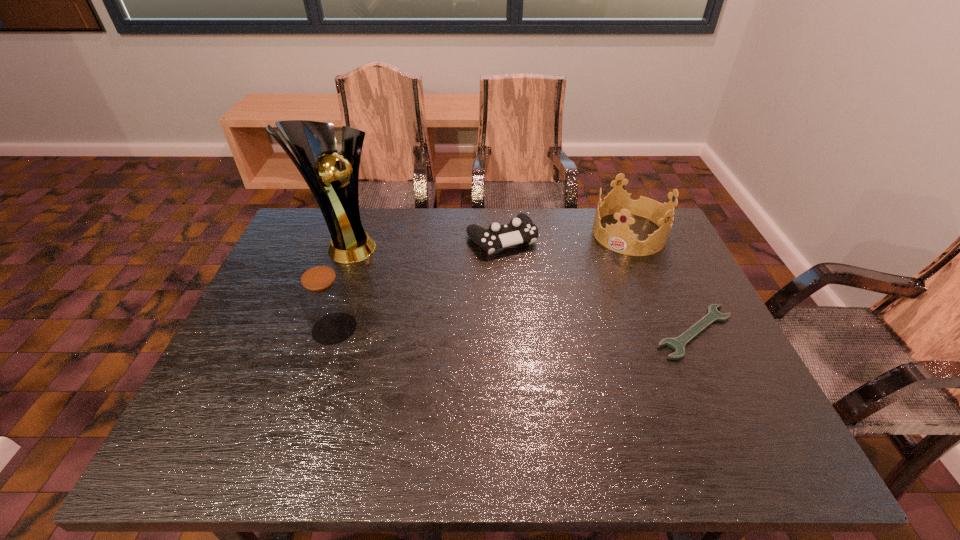
Image resolution: width=960 pixels, height=540 pixels. Identify the location of free spot at the near right corner of the desktop. (722, 389).

I want to click on free point between the tiara and the shortest object, so click(661, 282).

Locate an element on the screen. free space between the tiara and the control is located at coordinates (565, 237).

Where is `free space between the control and the shortest object`? This screenshot has width=960, height=540. free space between the control and the shortest object is located at coordinates (598, 286).

Where is `unoccupied position between the tallest object and the second shortest object`? The width and height of the screenshot is (960, 540). unoccupied position between the tallest object and the second shortest object is located at coordinates (423, 242).

The height and width of the screenshot is (540, 960). I want to click on free space between the tiara and the third object from right to left, so click(565, 237).

At what (x,y) coordinates should I click in order to perform the action: click on the second closest object to the wrench. Please return your answer as a coordinate pair (x, y). The height and width of the screenshot is (540, 960). Looking at the image, I should click on (521, 229).

Identify the location of the second closest object relative to the jar. (521, 229).

What are the coordinates of `vacant area in the image that satisfies the following two spatial constraints: 1. on the front side of the wrench; 2. on the right side of the tallest object` in the screenshot? It's located at (313, 332).